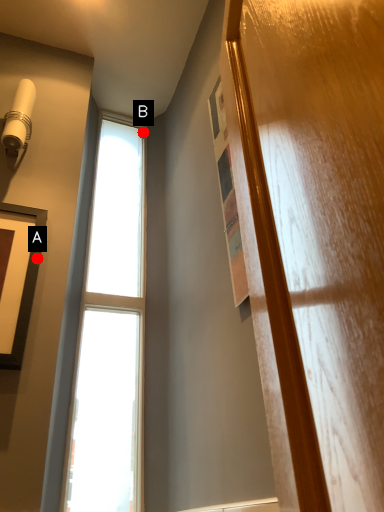
Question: Two points are circled on the image, labeled by A and B beside each circle. Which point is farther to the camera?

Choices:
 (A) A is further
 (B) B is further

Answer: (B)